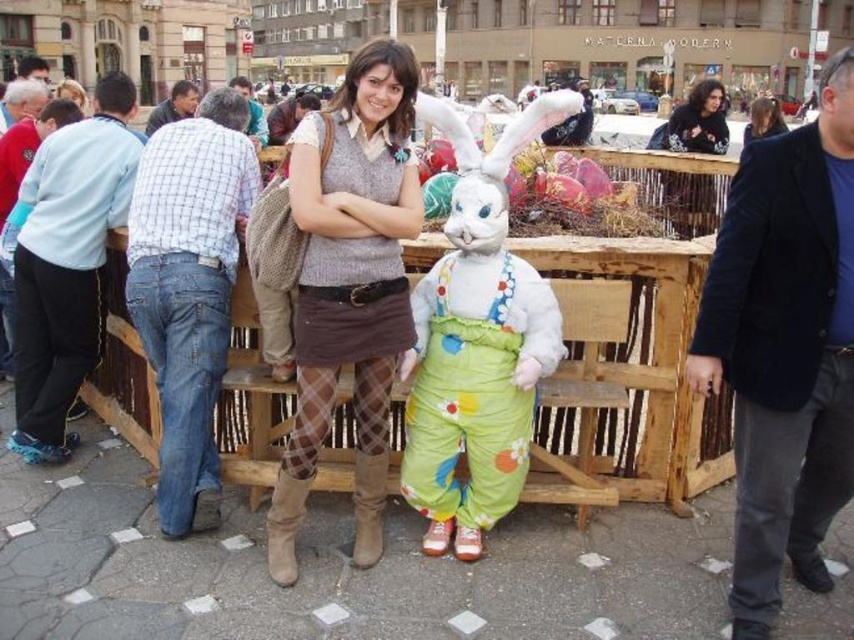
Question: Among these points, which one is farthest from the camera?

Choices:
 (A) (363, 481)
 (B) (218, 333)
 (C) (3, 93)
 (D) (468, 452)

Answer: (C)

Question: Which is farther from the fluffy white bunny at center?

Choices:
 (A) dark brown hair at upper right
 (B) blue jeans at left
 (C) plaid shirt at upper left
 (D) plaid shirt at center

Answer: (C)

Question: Is knitted sweater at center below brown suede boot at center?

Choices:
 (A) no
 (B) yes

Answer: (A)

Question: Observing the image, what is the correct spatial positioning of knitted sweater at center in reference to brown suede boot at center?

Choices:
 (A) right
 (B) left

Answer: (B)

Question: Can you confirm if dark brown hair at upper right is smaller than plaid shirt at upper left?

Choices:
 (A) no
 (B) yes

Answer: (A)

Question: Which point is closer to the camera?

Choices:
 (A) (720, 150)
 (B) (118, 106)
 (C) (186, 116)

Answer: (B)